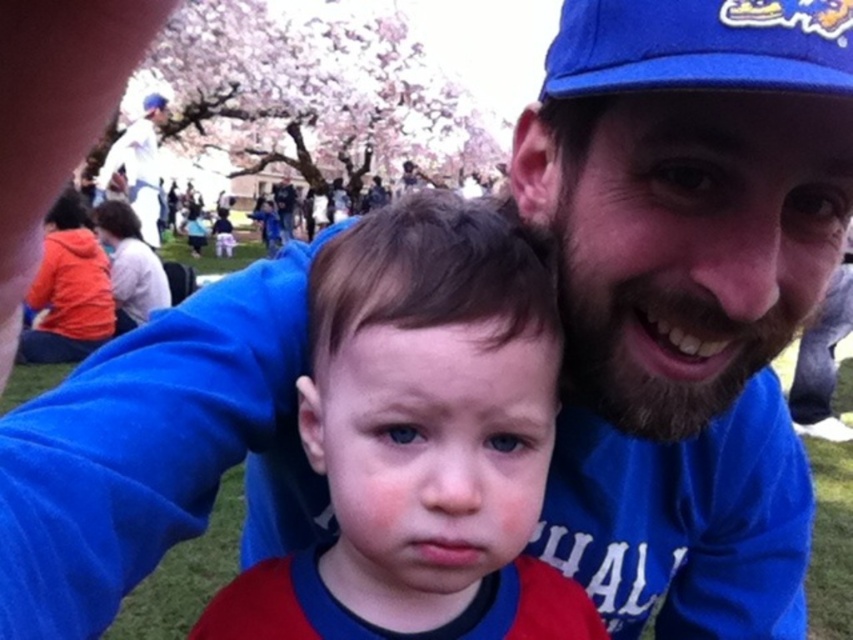
Question: Is smooth red shirt at center to the left of blue fabric baseball cap at upper right from the viewer's perspective?

Choices:
 (A) yes
 (B) no

Answer: (A)

Question: Does smooth red shirt at center appear under blue fabric baseball cap at upper right?

Choices:
 (A) no
 (B) yes

Answer: (B)

Question: Which point is closer to the camera?

Choices:
 (A) smooth red shirt at center
 (B) blue fabric baseball cap at upper right

Answer: (B)

Question: Does smooth red shirt at center lie behind blue fabric baseball cap at upper right?

Choices:
 (A) yes
 (B) no

Answer: (A)